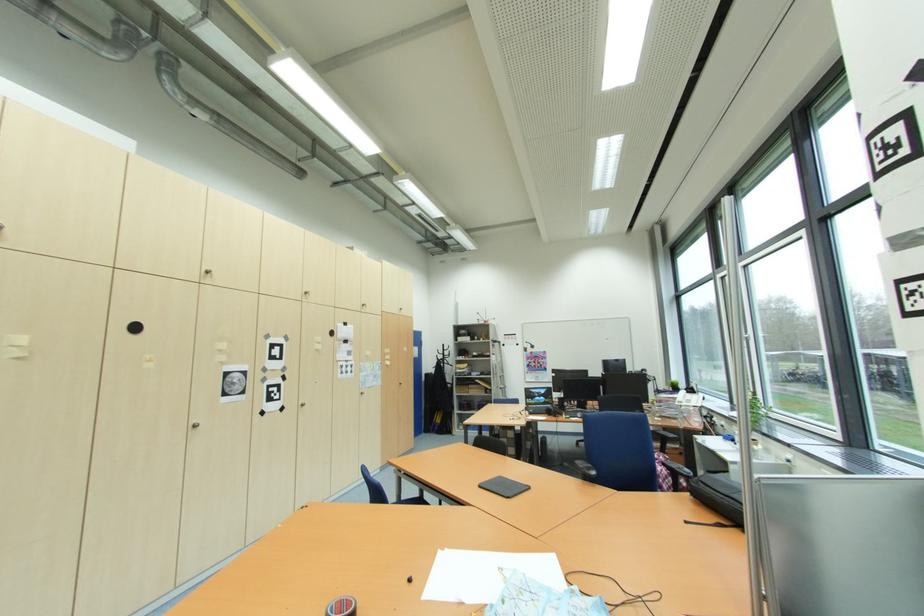
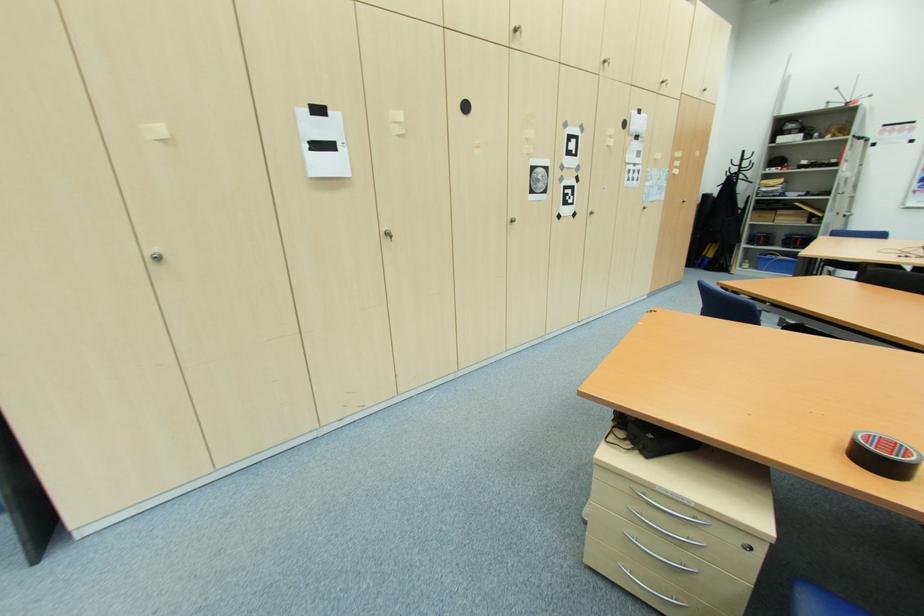
Based on the continuous images, in which direction is the camera rotating?

The camera's rotation is toward left-down.